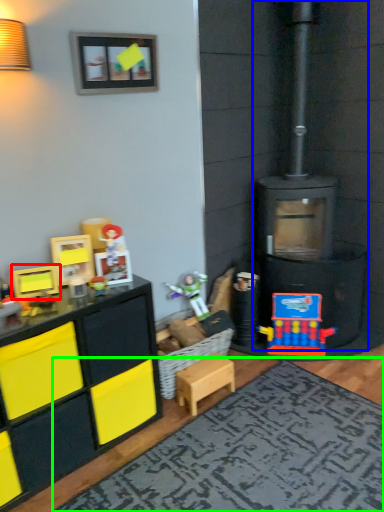
Question: Considering the real-world distances, which object is closest to toy (highlighted by a red box)? fireplace (highlighted by a blue box) or mat (highlighted by a green box).

Choices:
 (A) fireplace
 (B) mat

Answer: (B)